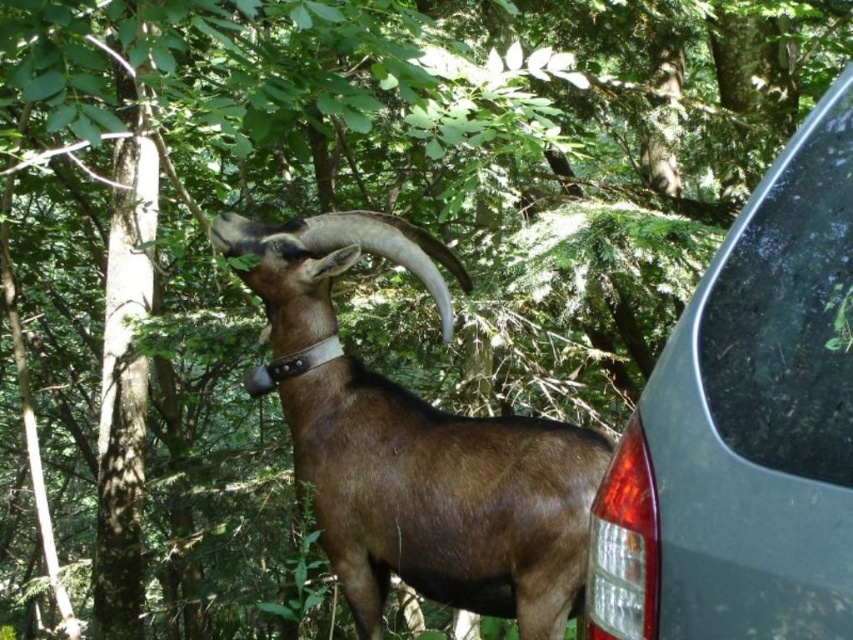
Question: Which object is the closest to the metallic gray car at right?

Choices:
 (A) brown matte goat at center
 (B) transparent glass at right

Answer: (B)

Question: Does metallic gray car at right lie in front of transparent glass at right?

Choices:
 (A) no
 (B) yes

Answer: (B)

Question: Which point appears closest to the camera in this image?

Choices:
 (A) pos(428,246)
 (B) pos(668,582)
 (C) pos(715,333)

Answer: (B)

Question: Can you confirm if metallic gray car at right is positioned to the left of transparent glass at right?

Choices:
 (A) yes
 (B) no

Answer: (A)

Question: Does metallic gray car at right come behind transparent glass at right?

Choices:
 (A) yes
 (B) no

Answer: (B)

Question: Which point is closer to the camera?

Choices:
 (A) transparent glass at right
 (B) brown matte goat at center
 (C) metallic gray car at right

Answer: (C)